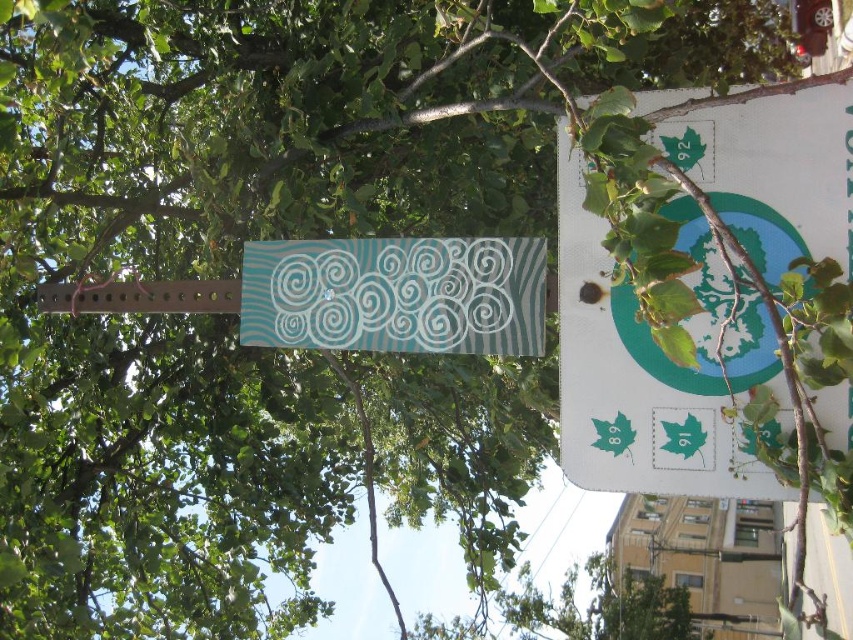
You are standing 2 meters away from the street sign. Can you reach the point at coordinates point (650, 99) on the sign without moving closer?

The distance of point (650, 99) from viewer is 1.77 meters, so yes, you can reach it without moving closer since you are standing 2 meters away, which is farther than the point.

You are a delivery driver who needs to attach a GPS tracker to the sign. The GPS tracker requires a minimum of 15 inches of space between the white paper sign at upper right and the teal matte sign at center. Can you attach it between them?

The distance between the white paper sign at upper right and the teal matte sign at center is 12.20 inches, which is less than the required 15 inches. Therefore, you cannot attach the GPS tracker between them.

You are a delivery driver who needs to read the route numbers on the white paper sign at upper right and the teal matte sign at center. Which sign will you need to look at more closely to read the numbers?

The teal matte sign at center is smaller than the white paper sign at upper right, so you will need to look at the teal matte sign at center more closely to read the numbers.